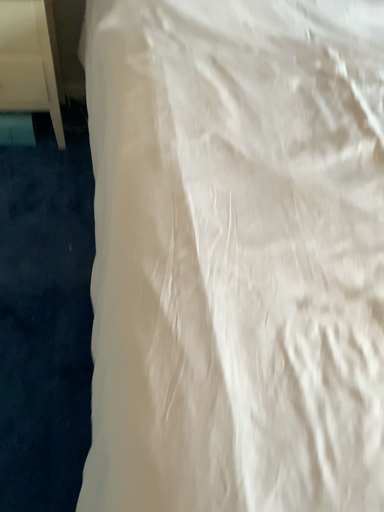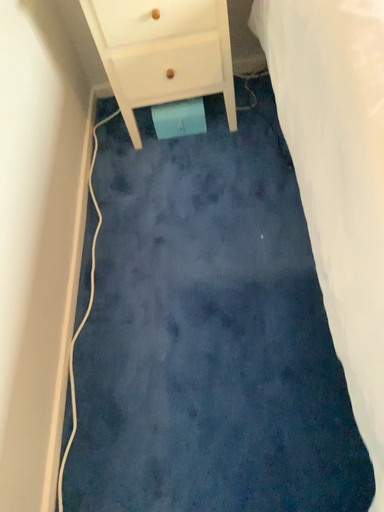
Question: Which way did the camera rotate in the video?

Choices:
 (A) rotated right
 (B) rotated left

Answer: (B)